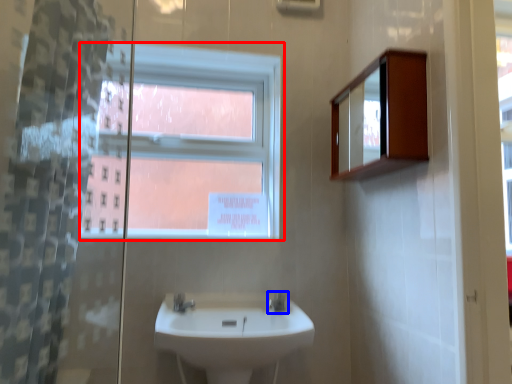
Question: Which object appears farthest to the camera in this image, window (highlighted by a red box) or tap (highlighted by a blue box)?

Choices:
 (A) window
 (B) tap

Answer: (A)